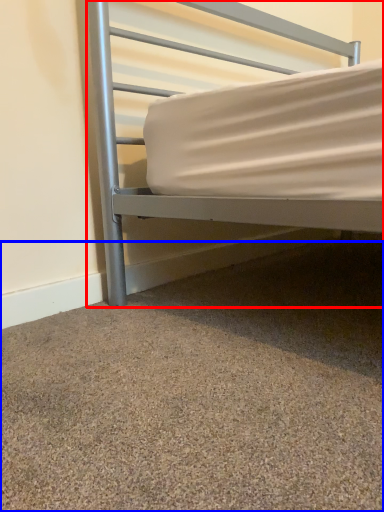
Question: Which object is further to the camera taking this photo, bed (highlighted by a red box) or granite (highlighted by a blue box)?

Choices:
 (A) bed
 (B) granite

Answer: (A)